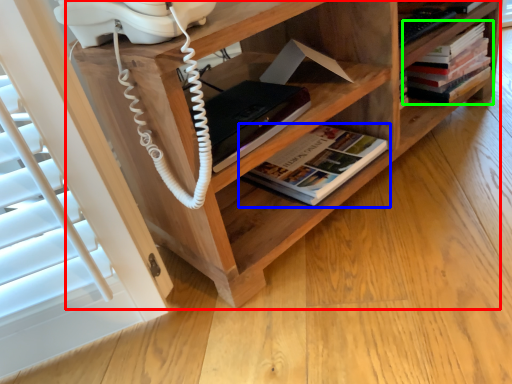
Question: Which object is positioned closest to shelf (highlighted by a red box)? Select from book (highlighted by a blue box) and book (highlighted by a green box).

Choices:
 (A) book
 (B) book

Answer: (A)